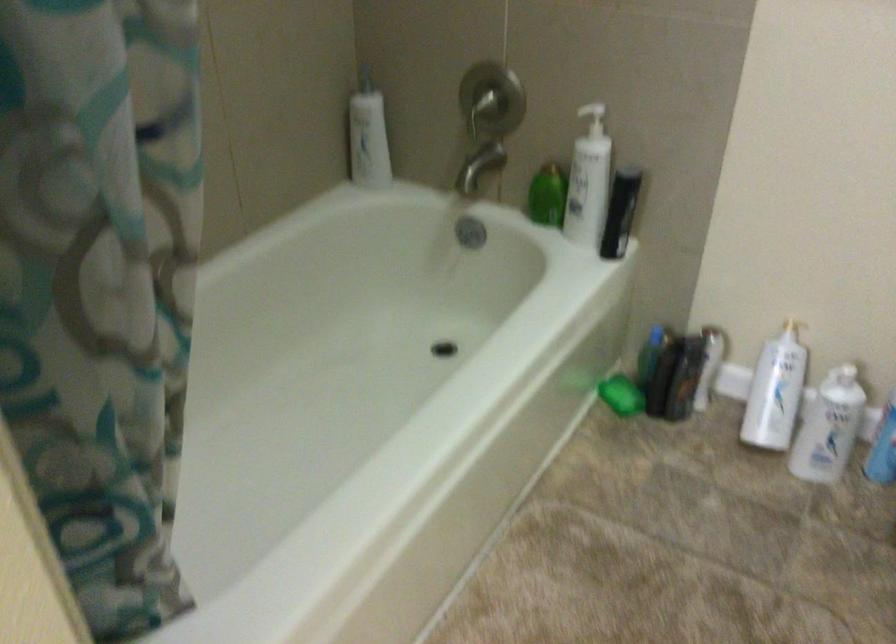
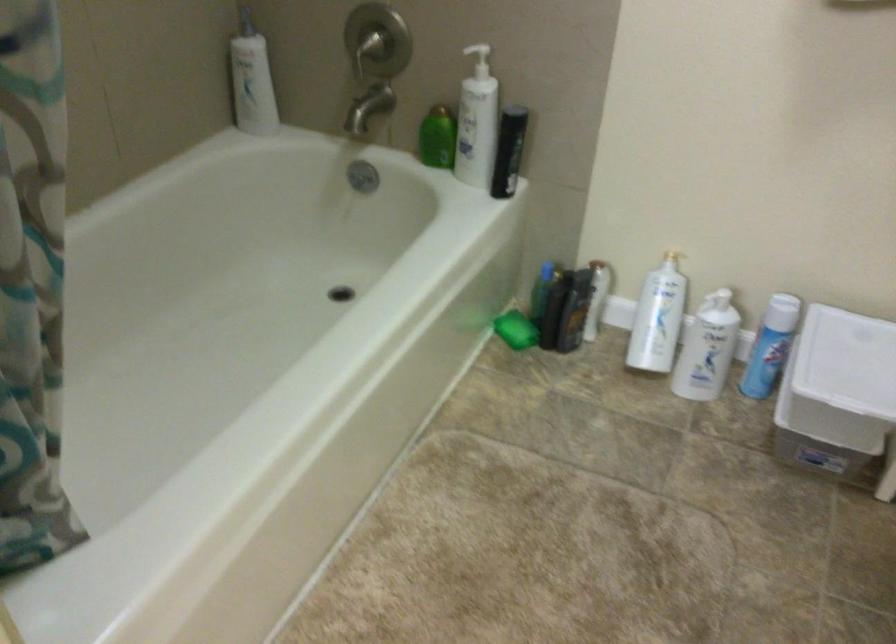
Find the pixel in the second image that matches [790,317] in the first image.

(672, 249)